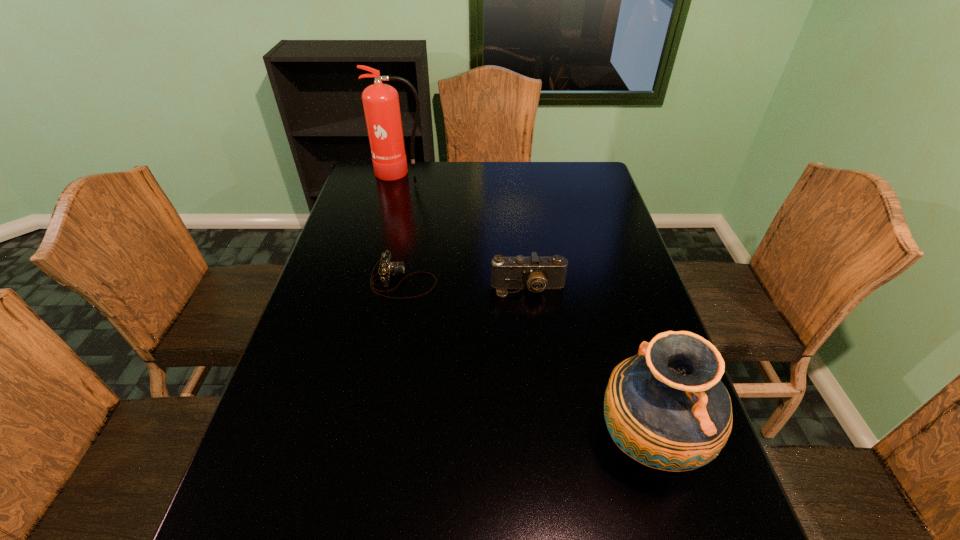
I want to click on the tallest object, so click(381, 105).

This screenshot has height=540, width=960. What are the coordinates of `the farthest object` in the screenshot? It's located at (381, 105).

Locate an element on the screen. the nearest object is located at coordinates (666, 407).

At what (x,y) coordinates should I click in order to perform the action: click on the third shortest object. Please return your answer as a coordinate pair (x, y). The width and height of the screenshot is (960, 540). Looking at the image, I should click on (666, 407).

Find the location of a particular element. The width and height of the screenshot is (960, 540). the second shortest object is located at coordinates (535, 273).

Where is `the taller camera`? This screenshot has height=540, width=960. the taller camera is located at coordinates (535, 273).

Where is `the shortest object`? The height and width of the screenshot is (540, 960). the shortest object is located at coordinates (387, 268).

Identify the location of the shorter camera. The width and height of the screenshot is (960, 540). click(x=387, y=268).

This screenshot has width=960, height=540. In order to click on free space located 0.160m towards the nozzle of the farthest object in this screenshot , I will do `click(392, 206)`.

Where is `vacant region located on the front of the second tallest object`? vacant region located on the front of the second tallest object is located at coordinates (676, 539).